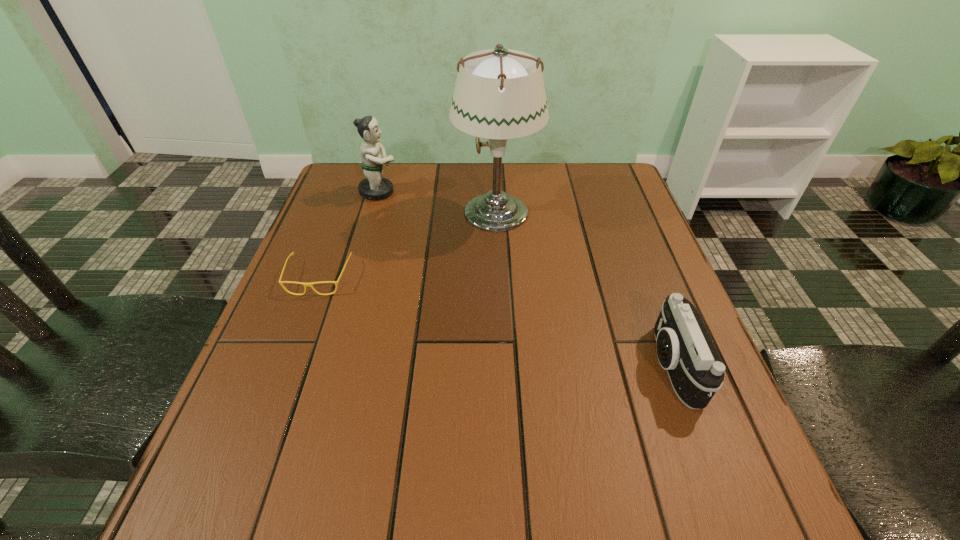
You are a GUI agent. You are given a task and a screenshot of the screen. Output one action in this format:
    pyautogui.click(x=<x>, y=<y>)
    Task: Click on the free spot between the shortest object and the third tallest object
    
    Given the screenshot: What is the action you would take?
    pyautogui.click(x=495, y=322)

This screenshot has width=960, height=540. I want to click on free space between the nearest object and the shortest object, so click(495, 322).

You are a GUI agent. You are given a task and a screenshot of the screen. Output one action in this format:
    pyautogui.click(x=<x>, y=<y>)
    Task: Click on the free space between the second tallest object and the nearest object
    
    Given the screenshot: What is the action you would take?
    pyautogui.click(x=526, y=279)

I want to click on empty space that is in between the tallest object and the figurine, so click(438, 201).

Where is `blank region between the third shortest object and the second shortest object`? blank region between the third shortest object and the second shortest object is located at coordinates (526, 279).

Locate an element on the screen. Image resolution: width=960 pixels, height=540 pixels. free space that is in between the camera and the shortest object is located at coordinates (495, 322).

Locate an element on the screen. free space between the spectacles and the lampshade is located at coordinates (407, 245).

Select which object appears as the closest to the third shortest object. Please provide its 2D coordinates. Your answer should be formatted as a tuple, i.e. [(x, y)], where the tuple contains the x and y coordinates of a point satisfying the conditions above.

[(499, 94)]

Identify which object is the second closest to the rightmost object. Please provide its 2D coordinates. Your answer should be formatted as a tuple, i.e. [(x, y)], where the tuple contains the x and y coordinates of a point satisfying the conditions above.

[(280, 282)]

You are a GUI agent. You are given a task and a screenshot of the screen. Output one action in this format:
    pyautogui.click(x=<x>, y=<y>)
    Task: Click on the free spot that satisfies the following two spatial constraints: 1. on the front-facing side of the figurine; 2. in front of the lenses of the third farthest object
    This screenshot has width=960, height=540.
    Given the screenshot: What is the action you would take?
    pyautogui.click(x=354, y=278)